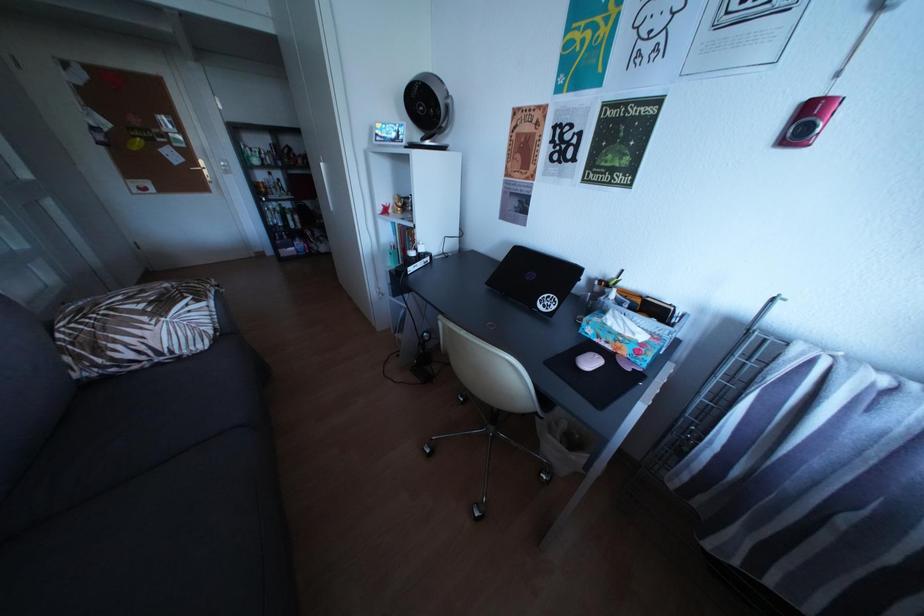
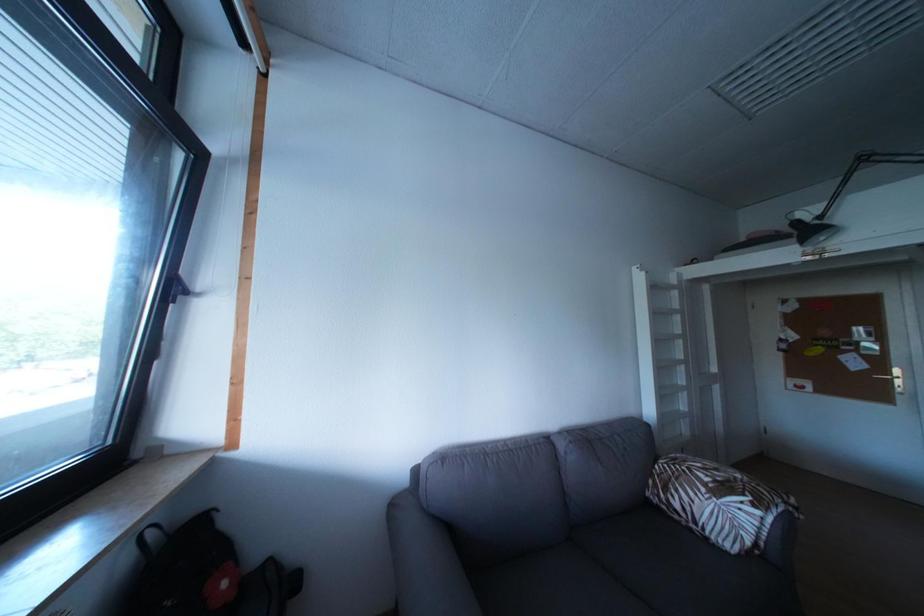
Question: How did the camera likely rotate?

Choices:
 (A) Left
 (B) Right
 (C) Up
 (D) Down

Answer: (A)